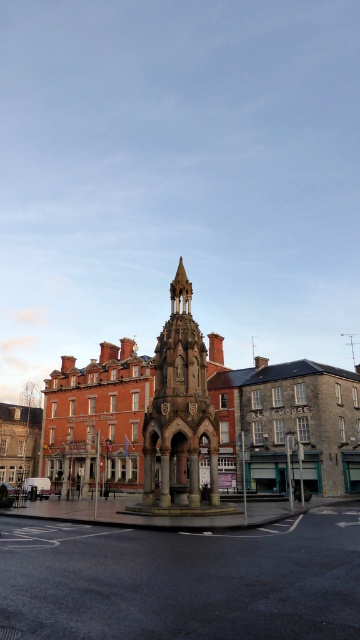
Is stone fountain at center taller than stone carved bell tower at center?

No, stone fountain at center is not taller than stone carved bell tower at center.

Who is more forward, (x=111, y=600) or (x=151, y=461)?

Point (x=111, y=600)

Image resolution: width=360 pixels, height=640 pixels. What are the coordinates of `stone fountain at center` in the screenshot? It's located at (178, 582).